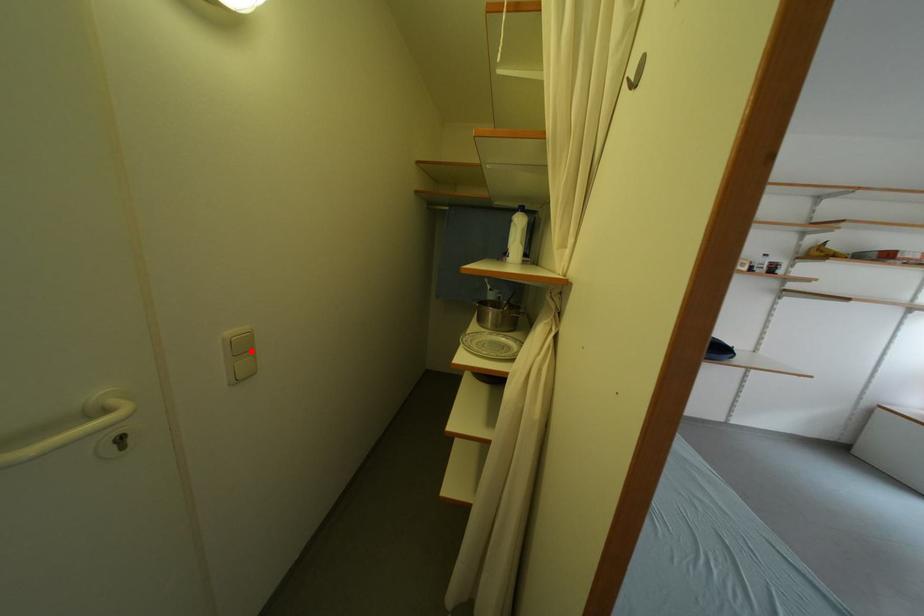
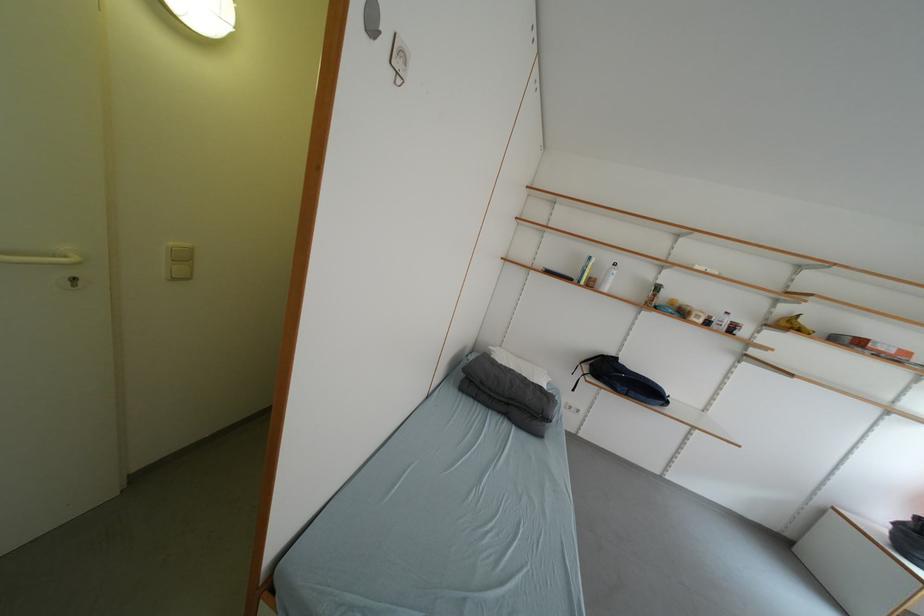
In the second image, find the point that corresponds to the highlighted location in the first image.

(191, 261)